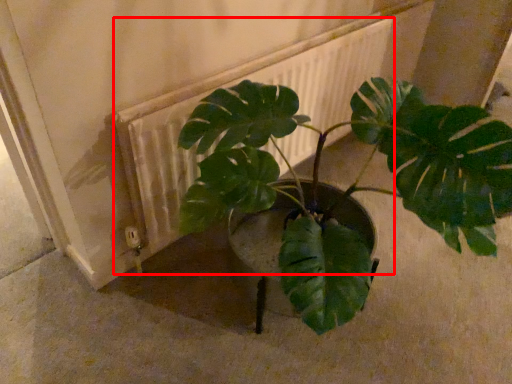
Question: Where is radiator (annotated by the red box) located in relation to houseplant in the image?

Choices:
 (A) right
 (B) left

Answer: (A)